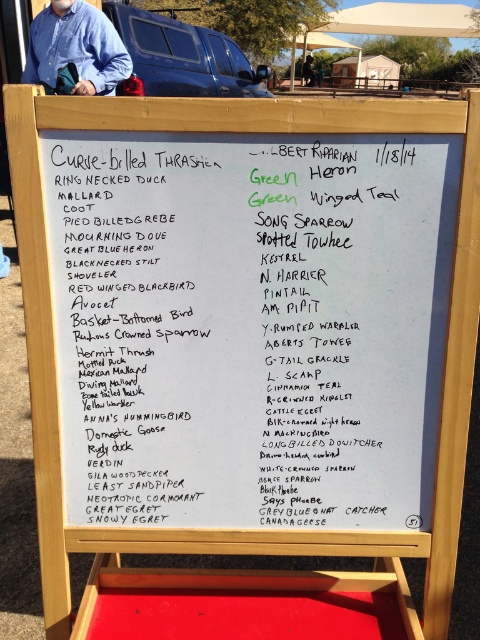
Question: Is green paper at upper center positioned before blue shirt at upper left?

Choices:
 (A) yes
 (B) no

Answer: (A)

Question: Which point is closer to the camera?

Choices:
 (A) blue cotton shirt at upper left
 (B) blue shirt at upper left

Answer: (A)

Question: Is white paperboard menu at upper center closer to the viewer compared to blue shirt at upper left?

Choices:
 (A) yes
 (B) no

Answer: (A)

Question: Does green paper at upper center appear over blue cotton shirt at upper left?

Choices:
 (A) yes
 (B) no

Answer: (B)

Question: Estimate the real-world distances between objects in this image. Which object is farther from the blue shirt at upper left?

Choices:
 (A) green paper at upper center
 (B) blue cotton shirt at upper left
 (C) white paperboard menu at upper center

Answer: (A)

Question: Which object is positioned farthest from the blue shirt at upper left?

Choices:
 (A) blue cotton shirt at upper left
 (B) white paperboard menu at upper center

Answer: (B)